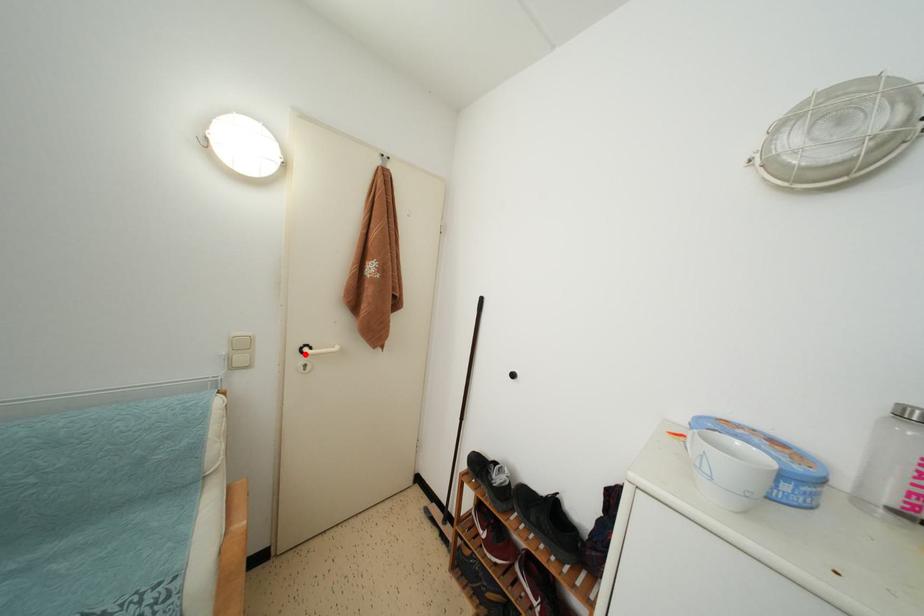
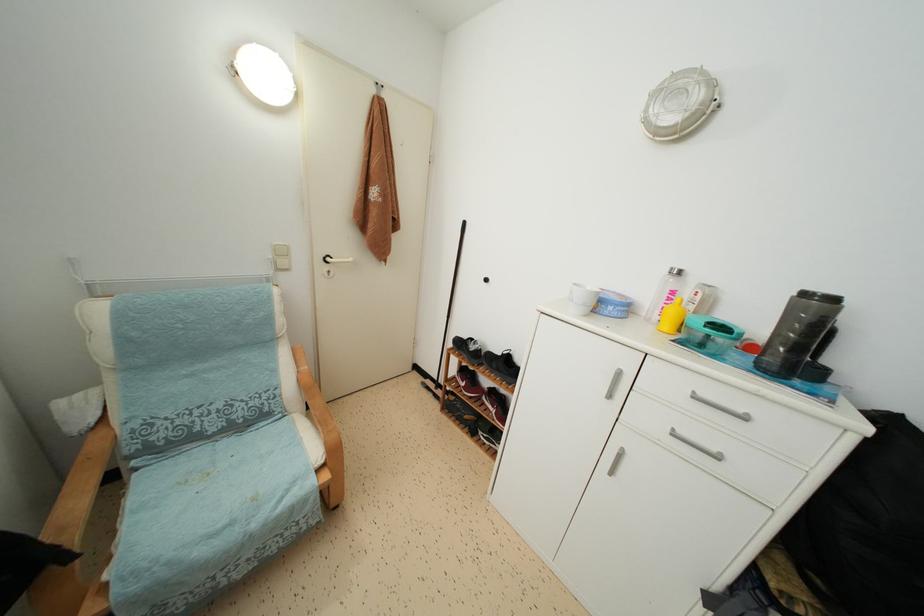
Question: I am providing you with two images of the same scene from different viewpoints. A red point is marked on the first image. Can you still see the location of the red point in image 2?

Choices:
 (A) Yes
 (B) No

Answer: (A)